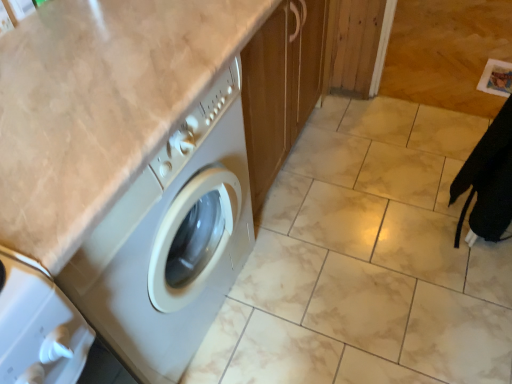
Question: From the image's perspective, is beige marble counter top at upper left positioned above or below marble tile at lower right?

Choices:
 (A) above
 (B) below

Answer: (B)

Question: Considering their positions, is beige marble counter top at upper left located in front of or behind marble tile at lower right?

Choices:
 (A) front
 (B) behind

Answer: (A)

Question: Is beige marble counter top at upper left wider or thinner than marble tile at lower right?

Choices:
 (A) wide
 (B) thin

Answer: (B)

Question: From the image's perspective, relative to beige marble counter top at upper left, is marble tile at lower right above or below?

Choices:
 (A) above
 (B) below

Answer: (A)

Question: Considering the relative positions of marble tile at lower right and beige marble counter top at upper left in the image provided, is marble tile at lower right to the left or to the right of beige marble counter top at upper left?

Choices:
 (A) right
 (B) left

Answer: (A)

Question: From a real-world perspective, is marble tile at lower right above or below beige marble counter top at upper left?

Choices:
 (A) below
 (B) above

Answer: (A)

Question: Relative to beige marble counter top at upper left, is marble tile at lower right in front or behind?

Choices:
 (A) front
 (B) behind

Answer: (B)